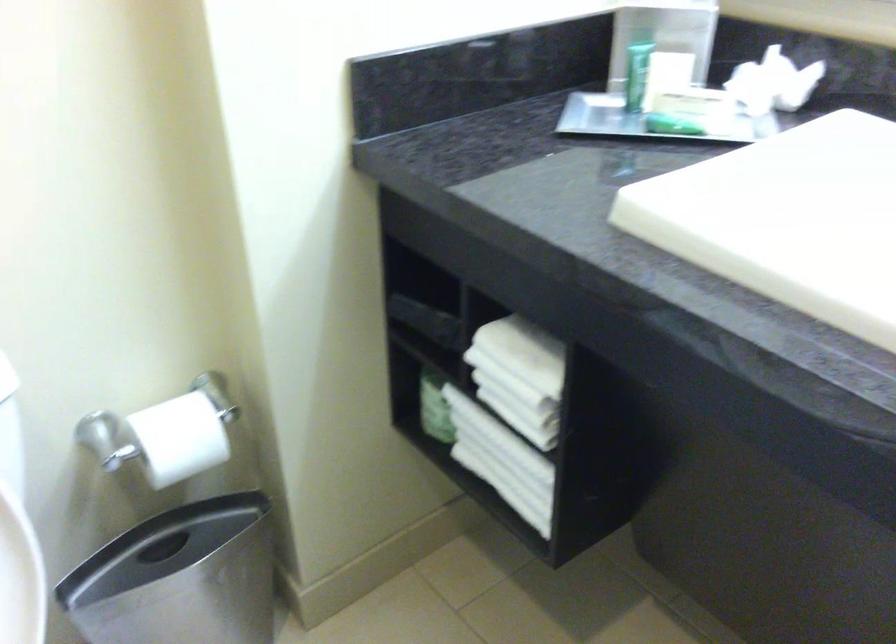
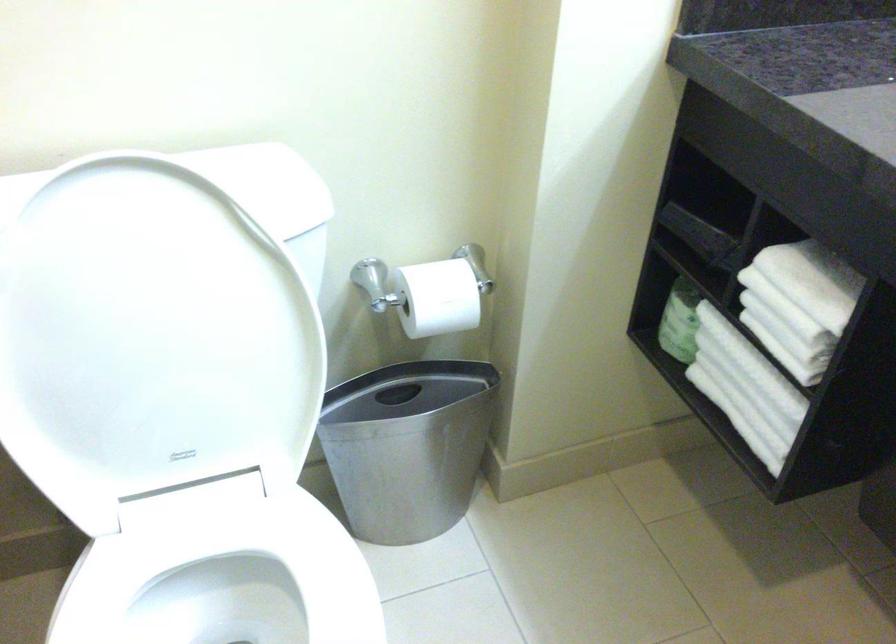
Locate, in the second image, the point that corresponds to [503,460] in the first image.

(745, 388)